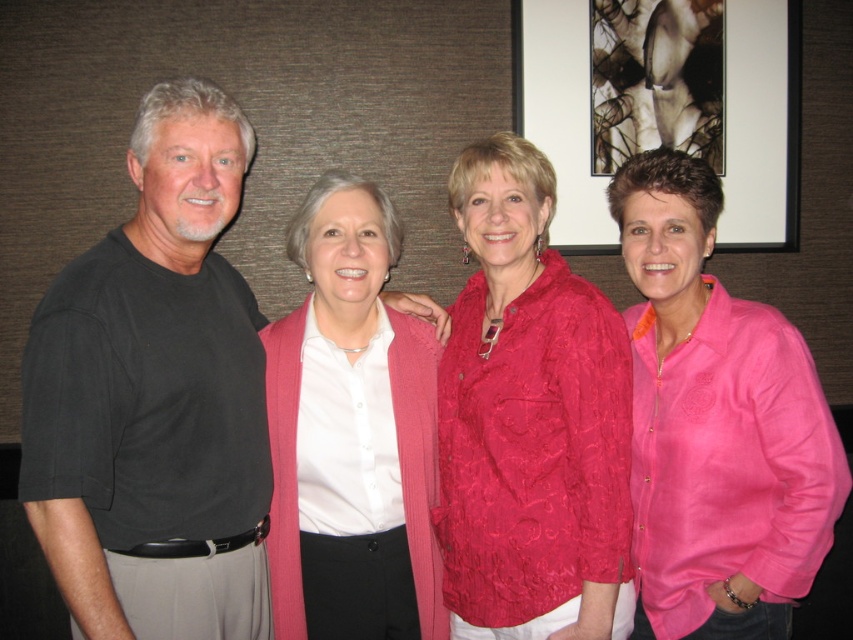
You are a photographer adjusting the lighting for a group photo. You notice the matte pink blouse at center and the pink knitted cardigan at center. Which clothing item is positioned higher on the person wearing them?

The matte pink blouse at center is located above the pink knitted cardigan at center, so the matte pink blouse at center is positioned higher on the person wearing them.